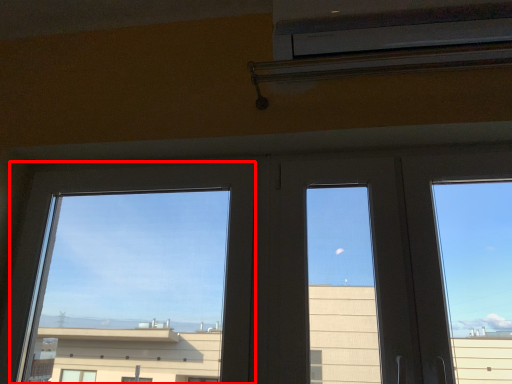
Question: From the image's perspective, what is the correct spatial positioning of window (annotated by the red box) in reference to air conditioning?

Choices:
 (A) below
 (B) above

Answer: (A)